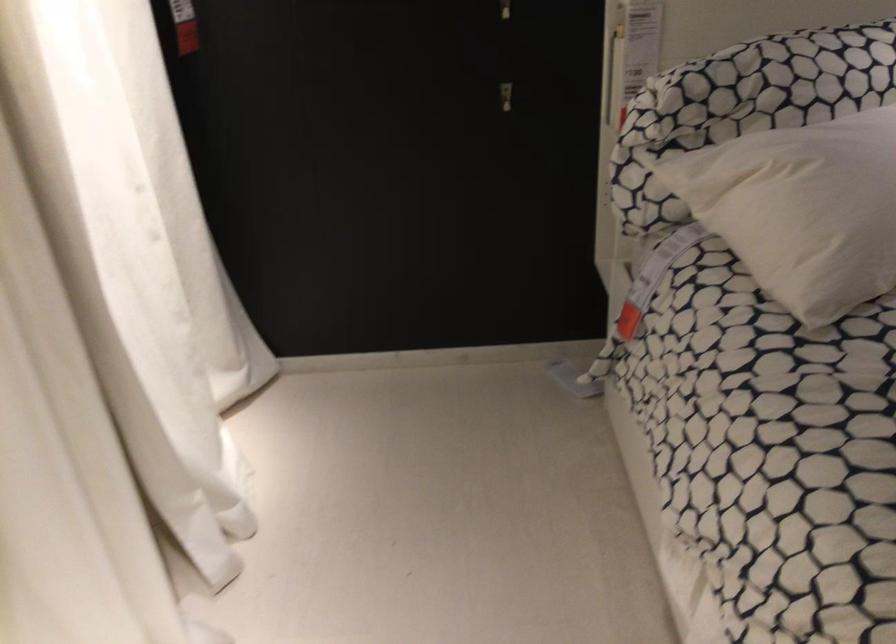
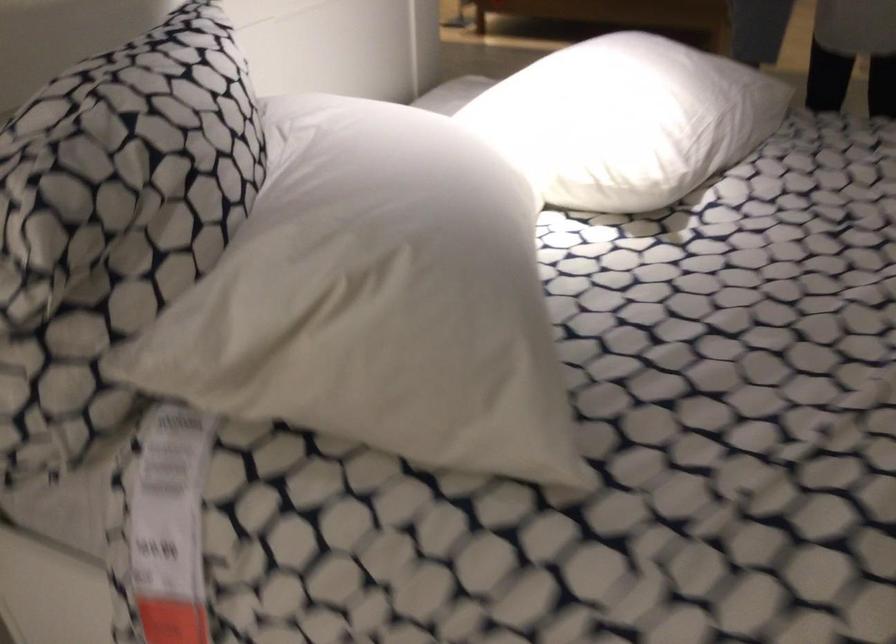
Locate, in the second image, the point that corresponds to (712,102) in the first image.

(116, 205)